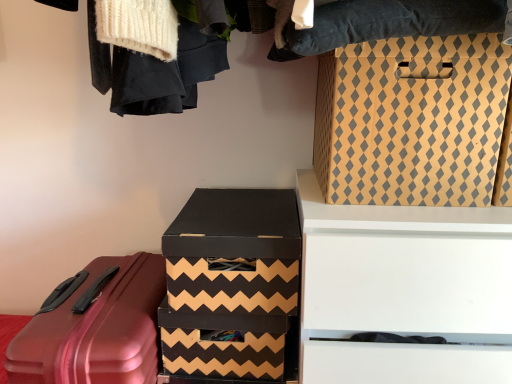
What are the coordinates of `blank space above black cardboard box at center, marked as the 2th box in a bottom-to-top arrangement (from a real-world perspective)` in the screenshot? It's located at (236, 206).